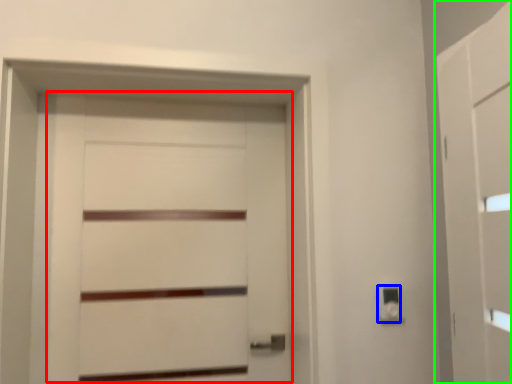
Question: Which object is the closest to the door (highlighted by a red box)? Choose among these: light switch (highlighted by a blue box) or barn door (highlighted by a green box).

Choices:
 (A) light switch
 (B) barn door

Answer: (A)